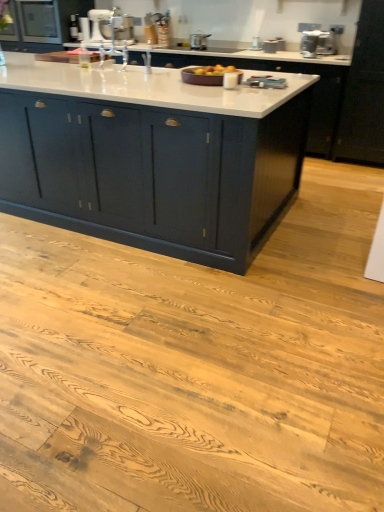
Question: Is the surface of matte black cabinet at upper left, arranged as the first cabinetry when viewed from the back, in direct contact with white glossy stand mixer at upper center, which ranks as the fifth appliance in right-to-left order?

Choices:
 (A) no
 (B) yes

Answer: (A)

Question: Does matte black cabinet at upper left, marked as the 2th cabinetry in a front-to-back arrangement, come behind white glossy stand mixer at upper center, which ranks as the fifth appliance in right-to-left order?

Choices:
 (A) no
 (B) yes

Answer: (A)

Question: Would you say matte black cabinet at upper left, marked as the 1th cabinetry in a top-to-bottom arrangement, is outside white glossy stand mixer at upper center, positioned as the 1th appliance in left-to-right order?

Choices:
 (A) no
 (B) yes

Answer: (B)

Question: Does matte black cabinet at upper left, the 2th cabinetry positioned from the bottom, have a lesser width compared to white glossy stand mixer at upper center, which ranks as the fifth appliance in right-to-left order?

Choices:
 (A) no
 (B) yes

Answer: (A)

Question: Considering the relative sizes of matte black cabinet at upper left, arranged as the first cabinetry when viewed from the back, and white glossy stand mixer at upper center, which ranks as the fifth appliance in right-to-left order, in the image provided, is matte black cabinet at upper left, arranged as the first cabinetry when viewed from the back, smaller than white glossy stand mixer at upper center, which ranks as the fifth appliance in right-to-left order,?

Choices:
 (A) yes
 (B) no

Answer: (B)

Question: From a real-world perspective, is white glossy sink at upper center positioned above or below white glossy stand mixer at upper center, which ranks as the 5th appliance in front-to-back order?

Choices:
 (A) above
 (B) below

Answer: (B)

Question: Would you say white glossy sink at upper center is inside or outside white glossy stand mixer at upper center, which ranks as the fifth appliance in right-to-left order?

Choices:
 (A) outside
 (B) inside

Answer: (A)

Question: Looking at their shapes, would you say white glossy sink at upper center is wider or thinner than white glossy stand mixer at upper center, which ranks as the fifth appliance in right-to-left order?

Choices:
 (A) thin
 (B) wide

Answer: (B)

Question: Does point (112, 12) appear closer or farther from the camera than point (97, 10)?

Choices:
 (A) closer
 (B) farther

Answer: (A)

Question: Is metallic silver toaster at upper center, the 2th appliance in the back-to-front sequence, wider or thinner than satin silver toaster at upper right, which is the fifth appliance in left-to-right order?

Choices:
 (A) thin
 (B) wide

Answer: (A)

Question: From the image's perspective, relative to satin silver toaster at upper right, arranged as the first appliance when viewed from the right, is metallic silver toaster at upper center, which ranks as the 4th appliance in front-to-back order, above or below?

Choices:
 (A) below
 (B) above

Answer: (B)

Question: From a real-world perspective, is metallic silver toaster at upper center, which ranks as the 4th appliance in front-to-back order, positioned above or below satin silver toaster at upper right, arranged as the first appliance when viewed from the right?

Choices:
 (A) above
 (B) below

Answer: (B)

Question: Considering their positions, is metallic silver toaster at upper center, the 2th appliance in the back-to-front sequence, located in front of or behind satin silver toaster at upper right, arranged as the first appliance when viewed from the right?

Choices:
 (A) front
 (B) behind

Answer: (B)

Question: Considering their positions, is satin silver toaster at upper right, arranged as the first appliance when viewed from the right, located in front of or behind matte dark blue cabinet at center, placed as the second cabinetry when sorted from top to bottom?

Choices:
 (A) front
 (B) behind

Answer: (B)

Question: Is satin silver toaster at upper right, the 4th appliance positioned from the back, situated inside matte dark blue cabinet at center, which is the first cabinetry in front-to-back order, or outside?

Choices:
 (A) outside
 (B) inside

Answer: (A)